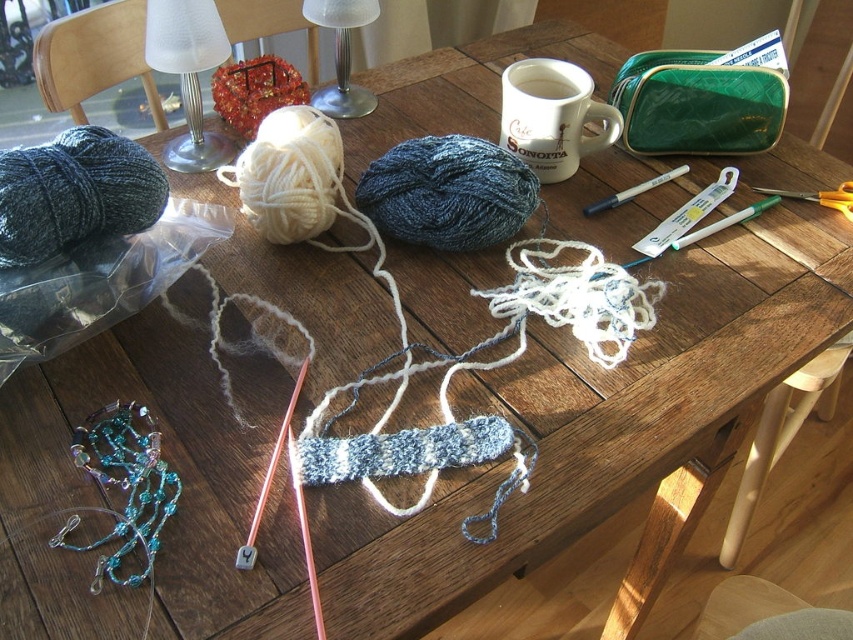
Which is above, dark gray yarn at left or yellow plastic scissors at upper right?

yellow plastic scissors at upper right is above.

Consider the image. Is dark gray yarn at left further to camera compared to yellow plastic scissors at upper right?

No, it is in front of yellow plastic scissors at upper right.

Does point (10, 156) come behind point (785, 196)?

That is False.

This screenshot has width=853, height=640. In order to click on dark gray yarn at left in this screenshot , I will do `click(74, 193)`.

Is the position of white frosted glass lamp at upper left less distant than that of yellow plastic scissors at upper right?

Yes, it is in front of yellow plastic scissors at upper right.

Can you confirm if white frosted glass lamp at upper left is positioned below yellow plastic scissors at upper right?

No, white frosted glass lamp at upper left is not below yellow plastic scissors at upper right.

Find the location of a particular element. Image resolution: width=853 pixels, height=640 pixels. white frosted glass lamp at upper left is located at coordinates (189, 74).

Is dark blue yarn at center further to camera compared to white ceramic mug at upper center?

No, it is in front of white ceramic mug at upper center.

Between dark blue yarn at center and white ceramic mug at upper center, which one appears on the right side from the viewer's perspective?

white ceramic mug at upper center is more to the right.

Identify the location of dark blue yarn at center. The image size is (853, 640). (447, 193).